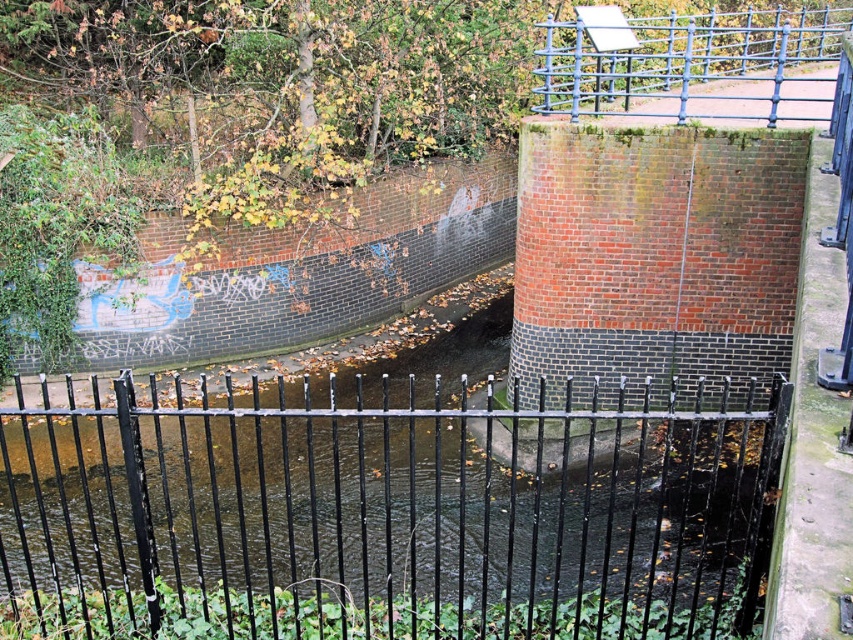
Which of these two, black wrought iron fence at center or blue metal fence at upper right, stands taller?

blue metal fence at upper right is taller.

Which is more to the right, black wrought iron fence at center or blue metal fence at upper right?

blue metal fence at upper right is more to the right.

The width and height of the screenshot is (853, 640). I want to click on black wrought iron fence at center, so click(x=376, y=518).